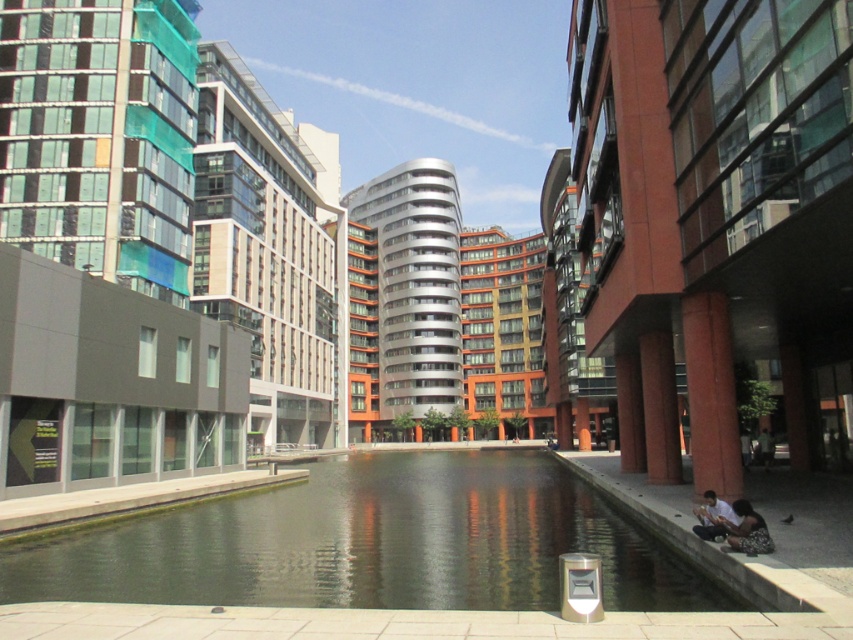
Question: Can you confirm if clear water at center is thinner than light brown fabric shirt at lower right?

Choices:
 (A) yes
 (B) no

Answer: (B)

Question: In this image, where is clear water at center located relative to floral dress at lower right?

Choices:
 (A) right
 (B) left

Answer: (B)

Question: Which of the following is the closest to the observer?

Choices:
 (A) click(x=737, y=524)
 (B) click(x=386, y=547)

Answer: (A)

Question: Does clear water at center appear under floral dress at lower right?

Choices:
 (A) yes
 (B) no

Answer: (A)

Question: Which point is farther to the camera?

Choices:
 (A) light brown fabric shirt at lower right
 (B) clear water at center
 (C) floral dress at lower right

Answer: (A)

Question: Which of the following is the closest to the observer?

Choices:
 (A) clear water at center
 (B) floral dress at lower right

Answer: (A)